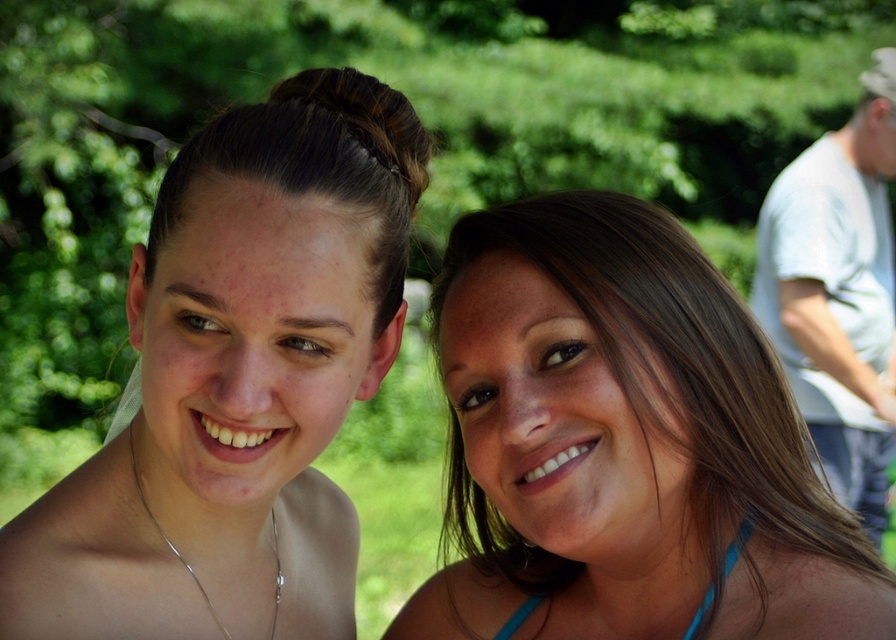
From the picture: How distant is matte brown hair bun at upper center from blue fabric bikini top at lower right?

matte brown hair bun at upper center and blue fabric bikini top at lower right are 15.08 inches apart from each other.

Which is behind, point (264, 177) or point (503, 632)?

Positioned behind is point (503, 632).

Does point (399, 275) come behind point (692, 621)?

That is False.

Image resolution: width=896 pixels, height=640 pixels. Identify the location of matte brown hair bun at upper center. (316, 161).

Between matte skin at center and matte brown hair bun at upper center, which one is positioned lower?

Positioned lower is matte skin at center.

Measure the distance between point (240,193) and camera.

Point (240,193) and camera are 36.12 inches apart.

Does point (371, 241) lie in front of point (151, 257)?

Yes.

I want to click on matte skin at center, so click(238, 381).

Between brown hair at center and matte brown hair bun at upper center, which one appears on the right side from the viewer's perspective?

brown hair at center is more to the right.

Based on the photo, between brown hair at center and matte brown hair bun at upper center, which one is positioned higher?

matte brown hair bun at upper center

Does point (838, 540) come in front of point (341, 68)?

No, (838, 540) is further to viewer.

Where is `brown hair at center`? The image size is (896, 640). brown hair at center is located at coordinates (625, 444).